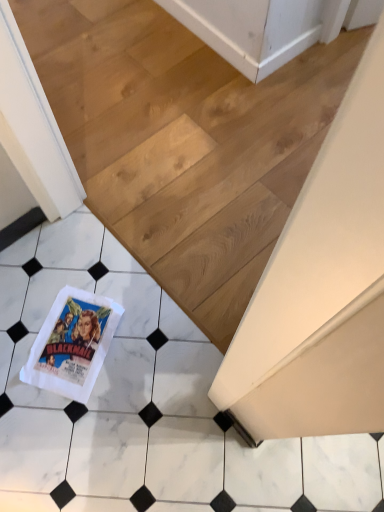
The height and width of the screenshot is (512, 384). In order to click on free point above white marble tile at lower left (from a real-world perspective) in this screenshot , I will do `click(119, 67)`.